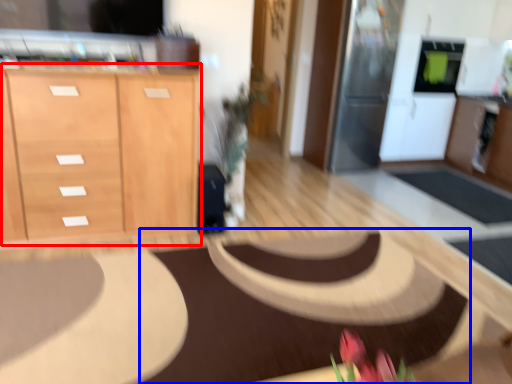
Question: Which object is further to the camera taking this photo, cabinetry (highlighted by a red box) or mat (highlighted by a blue box)?

Choices:
 (A) cabinetry
 (B) mat

Answer: (A)